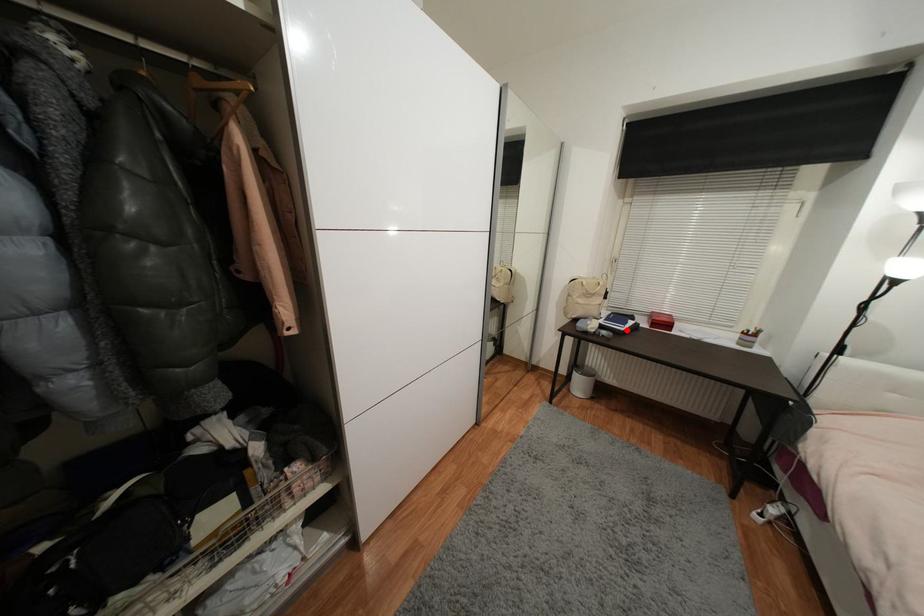
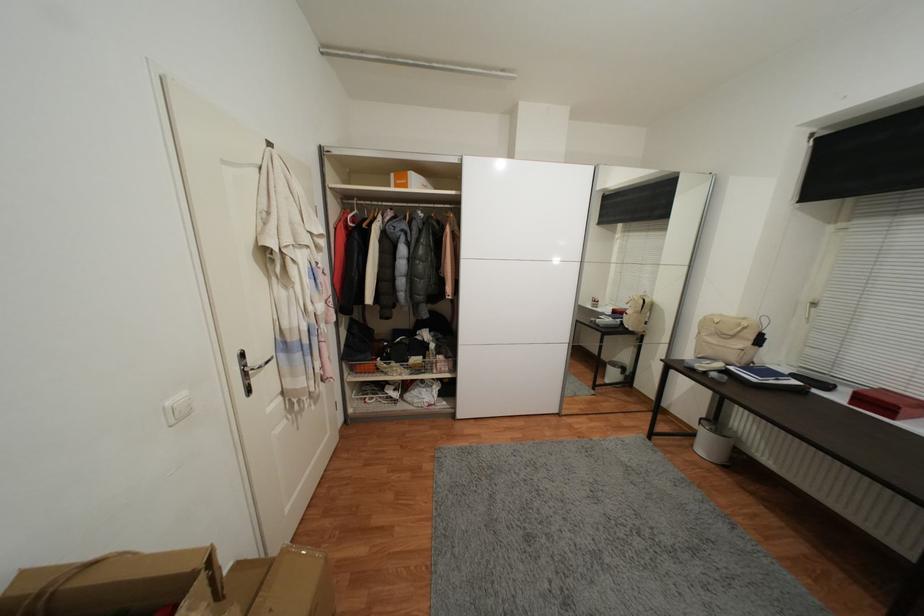
Find the pixel in the second image that matches the highlighted location in the first image.

(759, 381)